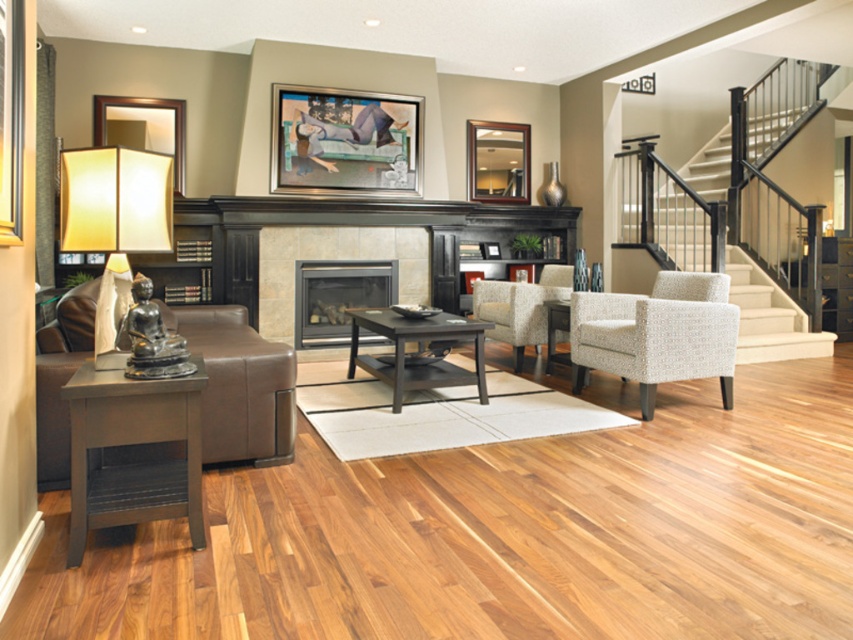
Can you confirm if metallic silver picture frame at upper center is smaller than matte black fireplace at center?

Actually, metallic silver picture frame at upper center might be larger than matte black fireplace at center.

Looking at this image, between metallic silver picture frame at upper center and matte black fireplace at center, which one is positioned higher?

metallic silver picture frame at upper center is above.

Is point (345, 160) positioned before point (370, 272)?

Yes, point (345, 160) is in front of point (370, 272).

Where is `metallic silver picture frame at upper center`? This screenshot has width=853, height=640. metallic silver picture frame at upper center is located at coordinates (344, 141).

Between brown leather armchair at left and dark wood coffee table at center, which one appears on the right side from the viewer's perspective?

dark wood coffee table at center is more to the right.

Does brown leather armchair at left appear under dark wood coffee table at center?

No, brown leather armchair at left is not below dark wood coffee table at center.

Find the location of a particular element. The height and width of the screenshot is (640, 853). brown leather armchair at left is located at coordinates (239, 385).

Can you confirm if matte gray end table at lower left is thinner than neutral textured armchair at center?

Correct, matte gray end table at lower left's width is less than neutral textured armchair at center's.

Does matte gray end table at lower left have a larger size compared to neutral textured armchair at center?

Actually, matte gray end table at lower left might be smaller than neutral textured armchair at center.

Identify the location of matte gray end table at lower left. (131, 451).